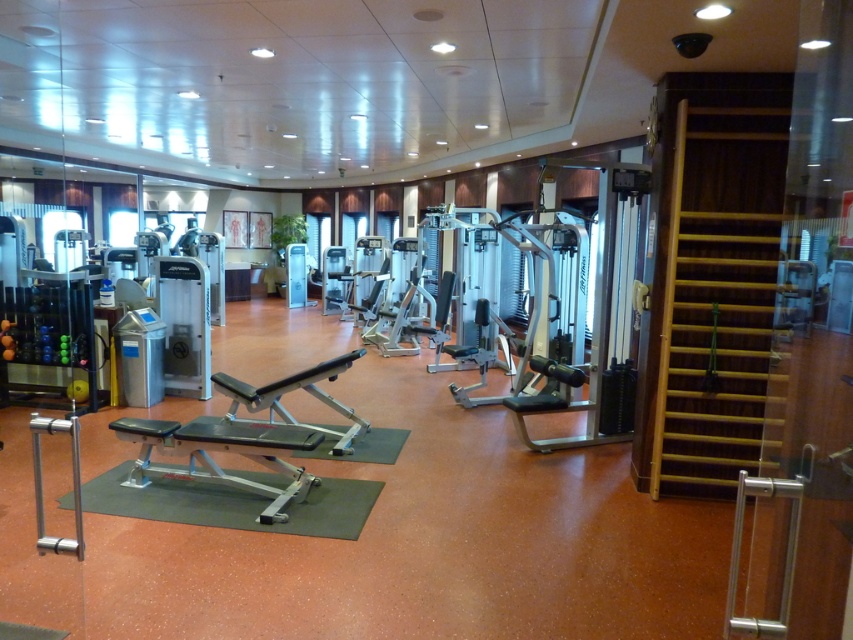
You are a personal trainer preparing for a client session. You need to place a 1.2 meter tall storage unit between the silver metallic bench at center and the green rubber mat at center. Is there enough vertical space between them to accommodate the storage unit?

The silver metallic bench at center has a greater height compared to green rubber mat at center. Since the storage unit is 1.2 meters tall, it can be placed between them as long as the vertical space between the two objects is at least 1.2 meters. However, the provided information does not specify the exact vertical distance between them, so we cannot confirm if there is enough space based solely on the height comparison.

You are a gym member trying to do a bench press. You see the silver metallic bench at center and the green rubber mat at center. Which object should you place your hands on to start the exercise?

You should place your hands on the silver metallic bench at center because it is the bench designed for the exercise, and it is positioned above the green rubber mat at center.

From the picture: You are standing at point [242,516] in the gym and want to move towards the entrance located at point [126,422]. Will you be moving forward or backward relative to your current position?

Since point [126,422] is behind point [242,516], moving towards it would mean you are moving backward relative to your current position.